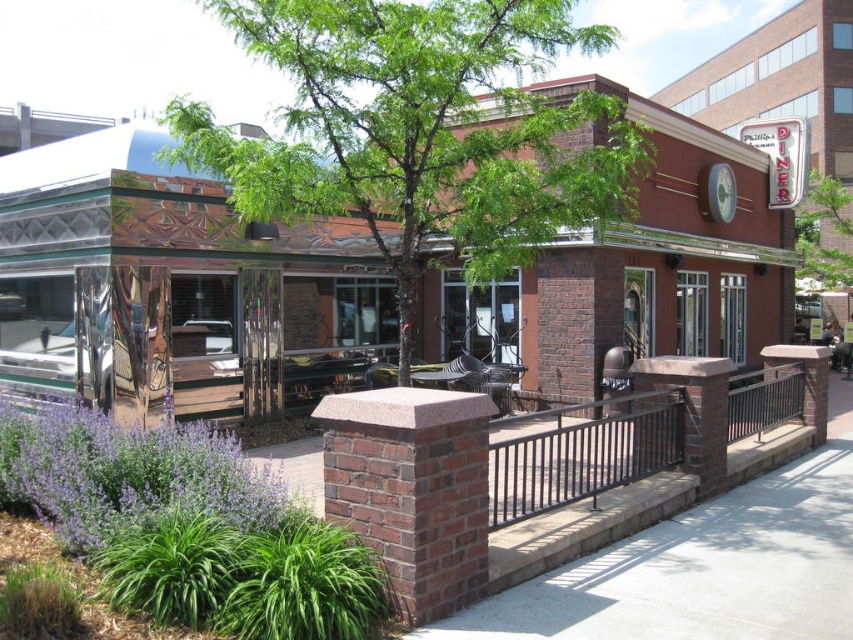
You are a customer standing at the entrance of the diner. You notice the black metal railing at lower right and the green leafy tree at upper center. Which object is physically closer to you as you face the entrance?

The black metal railing at lower right is closer to the viewer than the green leafy tree at upper center.